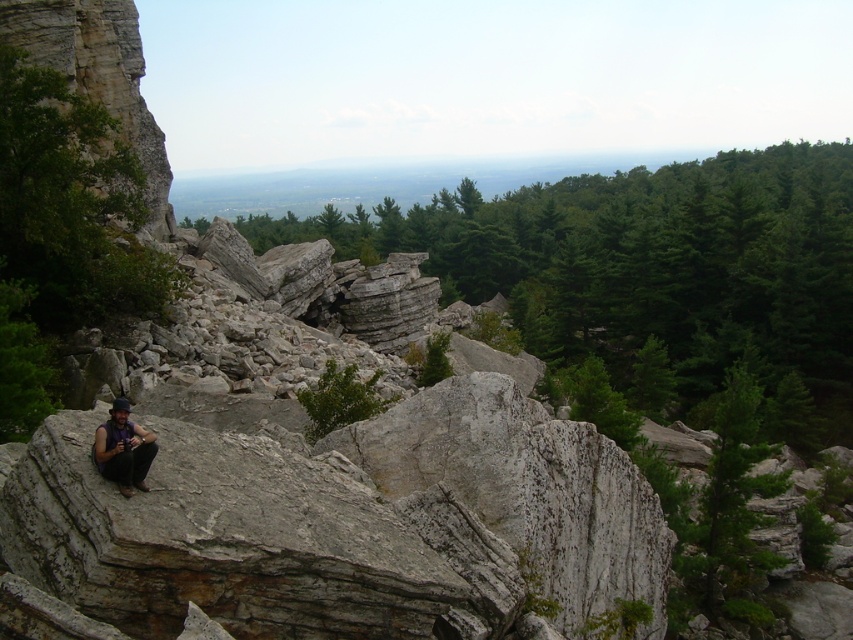
You are a hiker trying to decide between two plants for shade. You see a green matte tree at right and a green leafy shrub at center. Which one is wider?

The green matte tree at right might be wider than the green leafy shrub at center according to the description.

Looking at this image, you are standing at the center of the rocky landscape and want to take a photo of the green leafy tree at center. Which direction should you face to ensure the tree is in the center of your view?

The green leafy tree at center is located at point coordinates of (651, 273), so you should face towards the direction where the coordinates point to capture it in the center of your view.

You are standing at the viewpoint and want to take a photo of the green leafy tree at center. Your camera has a maximum focus range of 50 meters. Will you be able to focus on the tree?

The green leafy tree at center is 52.45 meters away from the viewer. Since the camera can only focus up to 50 meters, it won cannot focus on the tree.